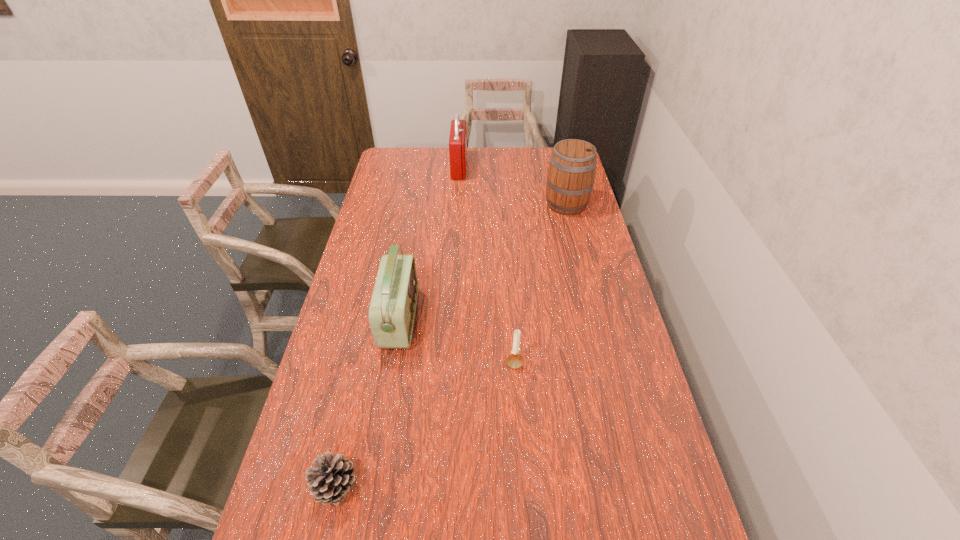
This screenshot has width=960, height=540. Find the location of `vacant space located on the left of the cider`. vacant space located on the left of the cider is located at coordinates (451, 205).

Find the location of a particular element. vacant position located 0.160m on the front panel of the radio receiver is located at coordinates (467, 319).

Locate an element on the screen. vacant area located on the left of the second shortest object is located at coordinates (468, 363).

Identify the location of free space located 0.380m on the back of the shortest object. The image size is (960, 540). (370, 340).

You are a GUI agent. You are given a task and a screenshot of the screen. Output one action in this format:
    pyautogui.click(x=<x>, y=<y>)
    Task: Click on the object that is at the far edge
    The height and width of the screenshot is (540, 960).
    Given the screenshot: What is the action you would take?
    pyautogui.click(x=457, y=140)

You are a GUI agent. You are given a task and a screenshot of the screen. Output one action in this format:
    pyautogui.click(x=<x>, y=<y>)
    Task: Click on the radio receiver that is at the left edge
    This screenshot has height=540, width=960.
    Given the screenshot: What is the action you would take?
    pyautogui.click(x=392, y=308)

In order to click on pinecone that is at the left edge in this screenshot , I will do `click(330, 479)`.

Find the location of `object situated at the right edge`. object situated at the right edge is located at coordinates (571, 174).

Find the location of `free spot at the far edge of the desktop`. free spot at the far edge of the desktop is located at coordinates (493, 165).

You are a GUI agent. You are given a task and a screenshot of the screen. Output one action in this format:
    pyautogui.click(x=<x>, y=<y>)
    Task: Click on the vacant space at the right edge of the desktop
    The height and width of the screenshot is (540, 960).
    Given the screenshot: What is the action you would take?
    pyautogui.click(x=561, y=248)